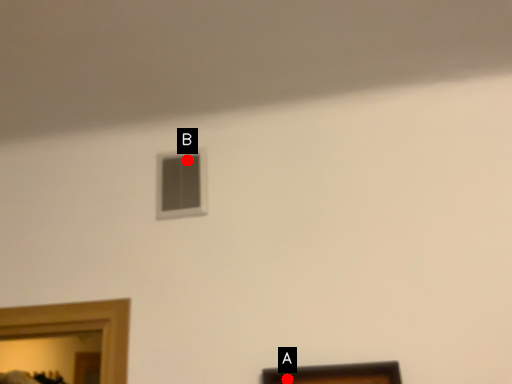
Question: Two points are circled on the image, labeled by A and B beside each circle. Which point is closer to the camera?

Choices:
 (A) A is closer
 (B) B is closer

Answer: (A)